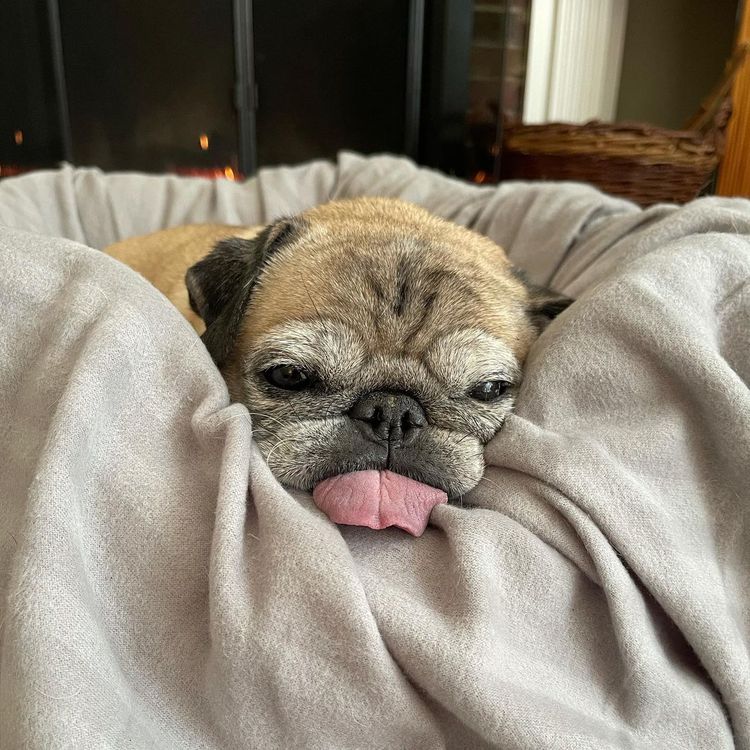
Find the location of a particular element. The height and width of the screenshot is (750, 750). rattan basket top right side is located at coordinates click(679, 165), click(616, 152).